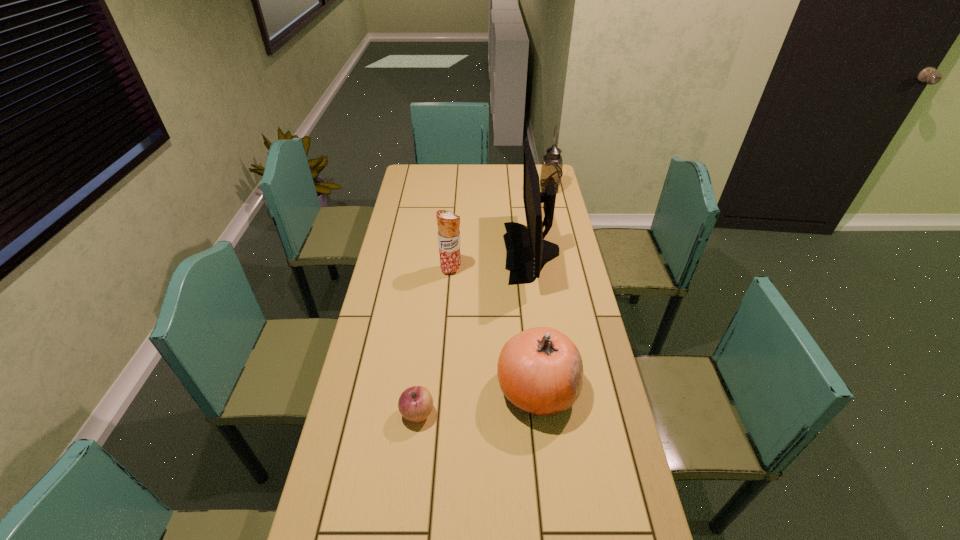
Locate an element on the screen. monitor is located at coordinates (527, 252).

The image size is (960, 540). I want to click on the farthest object, so click(x=551, y=170).

Locate an element on the screen. This screenshot has height=540, width=960. burrito is located at coordinates (x=448, y=223).

The width and height of the screenshot is (960, 540). What are the coordinates of `the fourth tallest object` in the screenshot? It's located at (540, 370).

At what (x,y) coordinates should I click in order to perform the action: click on apple. Please return your answer as a coordinate pair (x, y). Image resolution: width=960 pixels, height=540 pixels. Looking at the image, I should click on (415, 403).

In order to click on free space located 0.220m on the screen side of the monitor in this screenshot , I will do `click(449, 252)`.

In order to click on vacant space located 0.320m on the screen side of the monitor in this screenshot , I will do `click(425, 252)`.

At what (x,y) coordinates should I click in order to perform the action: click on free space located 0.310m on the screen side of the monitor. Please return your answer as a coordinate pair (x, y). This screenshot has height=540, width=960. Looking at the image, I should click on (427, 252).

Image resolution: width=960 pixels, height=540 pixels. I want to click on free spot located on the back of the oil lamp, so click(545, 173).

You are a GUI agent. You are given a task and a screenshot of the screen. Output one action in this format:
    pyautogui.click(x=<x>, y=<y>)
    Task: Click on the vacant space located 0.060m on the front of the burrito
    
    Given the screenshot: What is the action you would take?
    pyautogui.click(x=449, y=288)